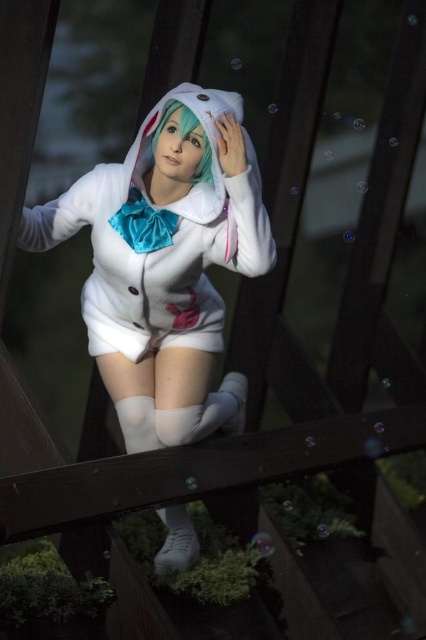
Question: Considering the relative positions of white plush bunny costume at center and green matte hair at center in the image provided, where is white plush bunny costume at center located with respect to green matte hair at center?

Choices:
 (A) left
 (B) right

Answer: (A)

Question: Does white plush bunny costume at center have a larger size compared to green matte hair at center?

Choices:
 (A) no
 (B) yes

Answer: (B)

Question: Which of the following is the farthest from the observer?

Choices:
 (A) green matte hair at center
 (B) white plush bunny costume at center

Answer: (A)

Question: Does white plush bunny costume at center appear under white fabric at center?

Choices:
 (A) no
 (B) yes

Answer: (B)

Question: Estimate the real-world distances between objects in this image. Which object is farther from the white fabric at center?

Choices:
 (A) white plush bunny costume at center
 (B) green matte hair at center

Answer: (B)

Question: Which object appears farthest from the camera in this image?

Choices:
 (A) white fabric at center
 (B) white plush bunny costume at center
 (C) green matte hair at center

Answer: (A)